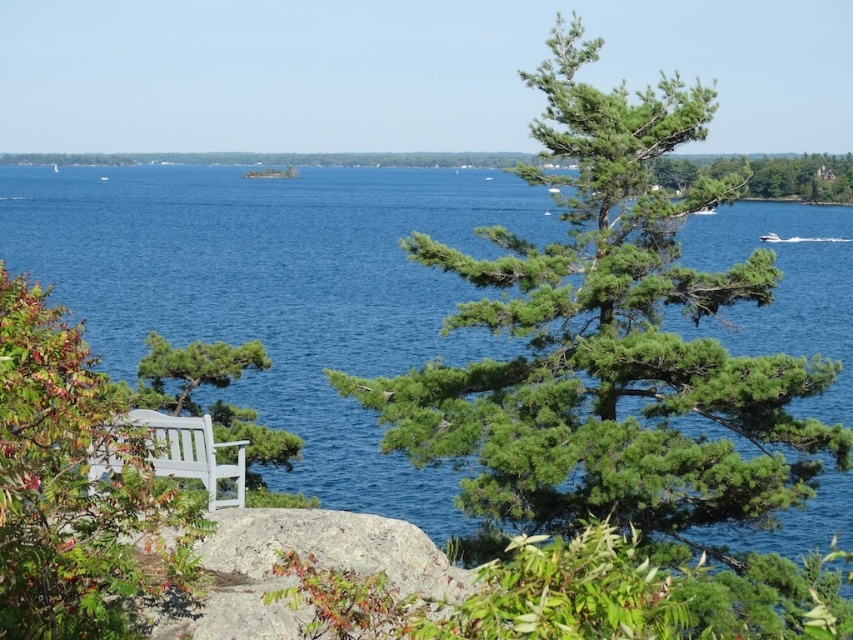
Question: Which point appears closest to the camera in this image?

Choices:
 (A) (225, 442)
 (B) (366, 474)

Answer: (A)

Question: In this image, where is green matte tree at lower left located relative to green matte tree at center?

Choices:
 (A) above
 (B) below

Answer: (A)

Question: Which of the following is the closest to the observer?

Choices:
 (A) (637, 449)
 (B) (355, 483)
 (C) (169, 417)
 (D) (202, 384)

Answer: (C)

Question: Which of the following is the farthest from the observer?

Choices:
 (A) (531, 403)
 (B) (160, 419)

Answer: (A)

Question: Is green needle-like tree at center closer to camera compared to green matte tree at center?

Choices:
 (A) no
 (B) yes

Answer: (B)

Question: Can you confirm if green matte tree at lower left is thinner than white painted wood bench at lower left?

Choices:
 (A) yes
 (B) no

Answer: (B)